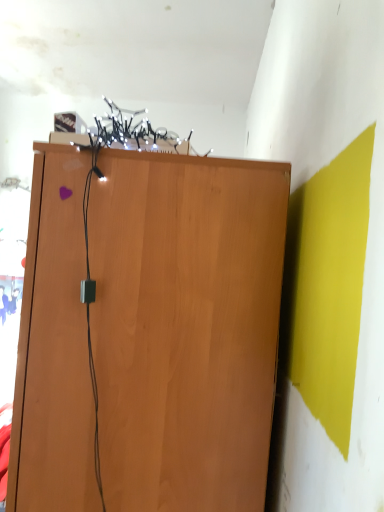
Describe the element at coordinates (186, 327) in the screenshot. I see `wooden wardrobe at center` at that location.

Measure the distance between point (110, 250) and camera.

Point (110, 250) and camera are 32.87 inches apart from each other.

The height and width of the screenshot is (512, 384). What are the coordinates of `wooden wardrobe at center` in the screenshot? It's located at (186, 327).

The height and width of the screenshot is (512, 384). I want to click on wooden wardrobe at center, so click(x=186, y=327).